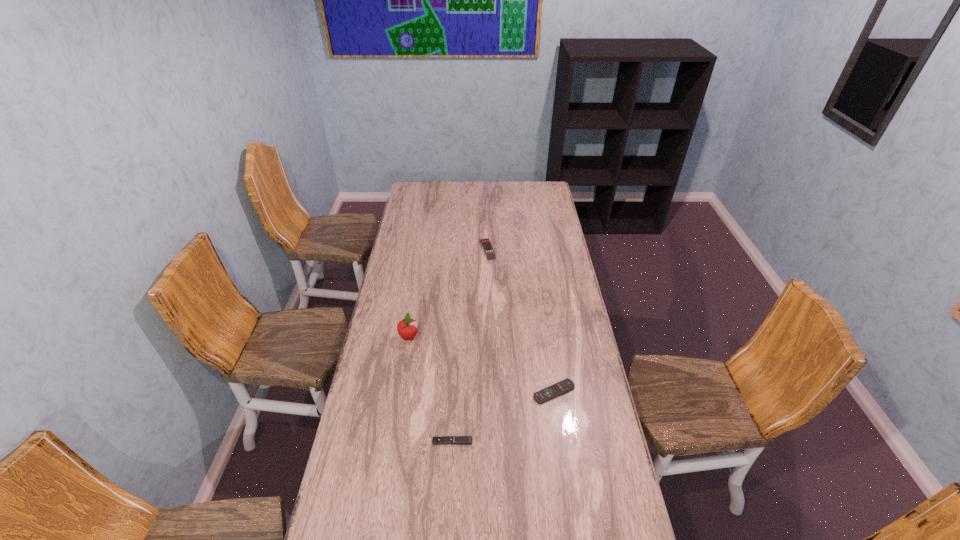
You are a GUI agent. You are given a task and a screenshot of the screen. Output one action in this format:
    pyautogui.click(x=<x>, y=<y>)
    Task: Click on the free spot between the leftmost remote control and the second remote control from left to right
    The height and width of the screenshot is (540, 960).
    Given the screenshot: What is the action you would take?
    pyautogui.click(x=469, y=345)

You are a GUI agent. You are given a task and a screenshot of the screen. Output one action in this format:
    pyautogui.click(x=<x>, y=<y>)
    Task: Click on the free space between the rightmost remote control and the leftmost object
    
    Given the screenshot: What is the action you would take?
    pyautogui.click(x=481, y=364)

At what (x,y) coordinates should I click in order to perform the action: click on free area in between the third object from right to left and the leftmost object. Please return your answer as a coordinate pair (x, y). The image size is (960, 540). Looking at the image, I should click on (430, 389).

The image size is (960, 540). What are the coordinates of `free area in between the farthest object and the second nearest object` in the screenshot? It's located at (520, 321).

Where is `vacant area that lies between the third farthest object and the second remote control from left to right`? vacant area that lies between the third farthest object and the second remote control from left to right is located at coordinates (520, 321).

At what (x,y) coordinates should I click in order to perform the action: click on vacant space that is in between the nearest remote control and the second nearest object. Please return your answer as a coordinate pair (x, y). The image size is (960, 540). Looking at the image, I should click on pos(503,417).

Image resolution: width=960 pixels, height=540 pixels. Find the location of `unoccupied area between the third nearest object and the rightmost object`. unoccupied area between the third nearest object and the rightmost object is located at coordinates (481, 364).

Image resolution: width=960 pixels, height=540 pixels. Identify the location of free space between the rightmost remote control and the second remote control from right to left. (520, 321).

Locate an element on the screen. This screenshot has height=540, width=960. empty space that is in between the apple and the farthest object is located at coordinates (448, 293).

Locate an element on the screen. This screenshot has width=960, height=540. object that stands as the closest to the rightmost remote control is located at coordinates (460, 440).